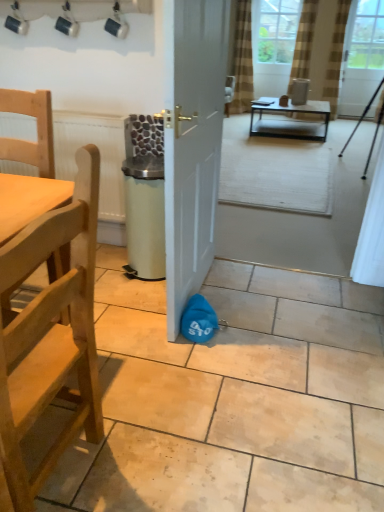
Where is `empty space that is to the right of wooden chair at left, placed as the second chair when sorted from top to bottom`? The height and width of the screenshot is (512, 384). empty space that is to the right of wooden chair at left, placed as the second chair when sorted from top to bottom is located at coordinates (151, 451).